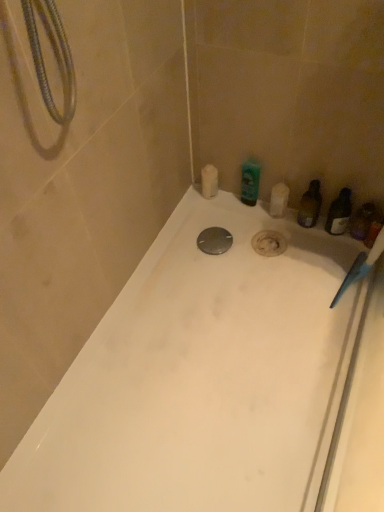
Find the location of a particular element. The image size is (384, 512). vacant area that lies between translucent plastic bottle at right, arranged as the third toiletry when viewed from the left, and white matte soap bar at upper center, the fourth toiletry positioned from the right is located at coordinates (253, 212).